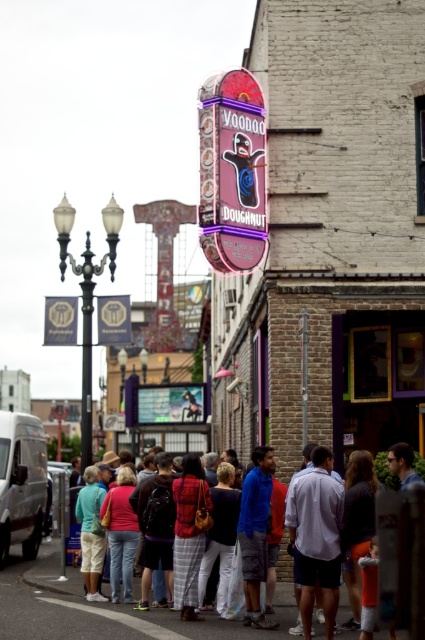
Who is positioned more to the left, plaid fabric shirt at center or white asphalt at lower center?

From the viewer's perspective, white asphalt at lower center appears more on the left side.

Is point (209, 627) farther from viewer compared to point (127, 624)?

No, it is not.

Identify the location of plaid fabric shirt at center. The width and height of the screenshot is (425, 640). (217, 630).

Can you confirm if gold metallic sign at left is taller than white asphalt at lower center?

Yes, gold metallic sign at left is taller than white asphalt at lower center.

Does gold metallic sign at left appear on the right side of white asphalt at lower center?

In fact, gold metallic sign at left is to the left of white asphalt at lower center.

Which is in front, point (73, 310) or point (110, 621)?

Point (110, 621)

Where is `gold metallic sign at left`? gold metallic sign at left is located at coordinates point(59,321).

Which is above, neon sign at center or gold metallic sign at left?

neon sign at center is above.

Which is behind, point (263, 156) or point (67, 310)?

Point (67, 310)

Which is behind, point (215, 102) or point (68, 296)?

The point (68, 296) is more distant.

Find the location of a particular element. This screenshot has height=640, width=425. neon sign at center is located at coordinates 232,172.